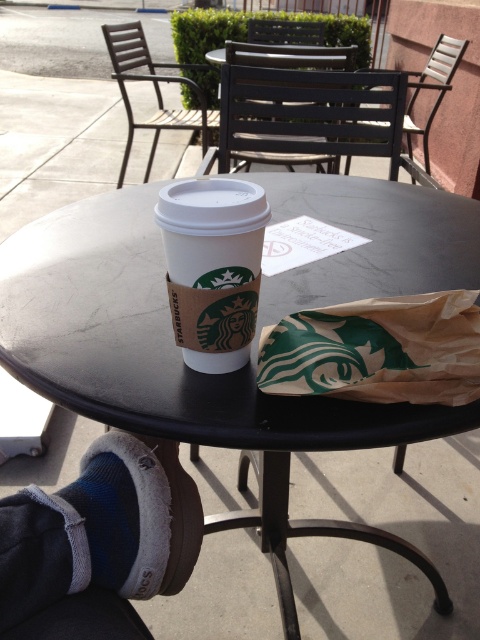
You are a person who is 1.7 meters tall and want to sit on the matte black chair at center. Considering the height of the brown paper cup at center, will your knees comfortably fit under the chair?

The matte black chair at center is taller than the brown paper cup at center. Since the chair is higher, your knees should comfortably fit under it when sitting.

You are a server at the outdoor seating area. You need to deliver a tray of drinks to the table. The tray is 8 feet long. Can you safely carry the tray through the space between the black matte round table at center and the metallic brown chair at center without spilling?

The distance between the black matte round table at center and the metallic brown chair at center is 7.75 feet. Since the tray is 8 feet long, it is slightly longer than the available space. To avoid spilling, you should adjust your path or reposition the tray to ensure it fits within the 7.75 feet gap.

You are a customer at the Starbucks outdoor seating area. You want to sit down at the black matte round table at center. Is the metallic brown chair at center suitable for this table?

The black matte round table at center has a smaller size compared to metallic brown chair at center, so the chair may not be suitable due to the size difference.